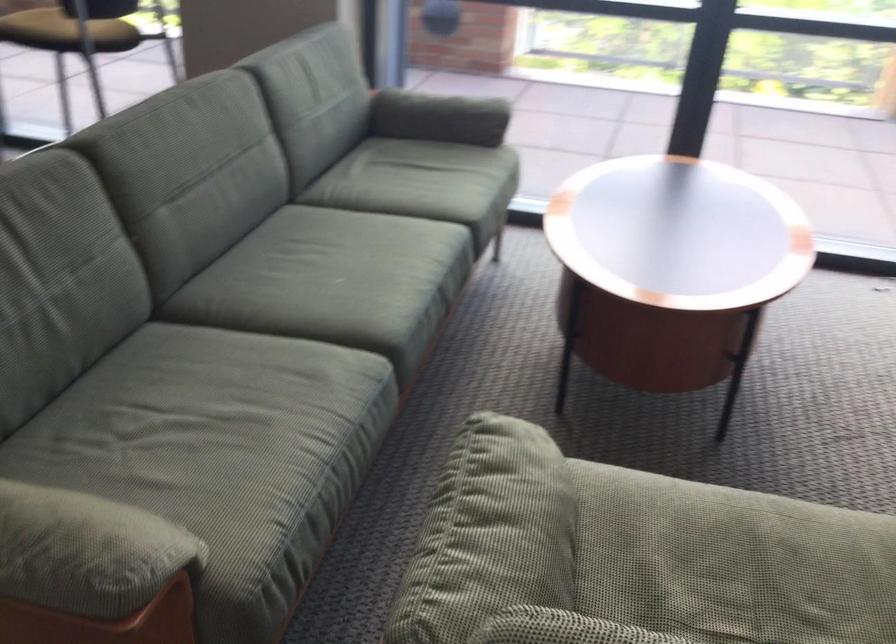
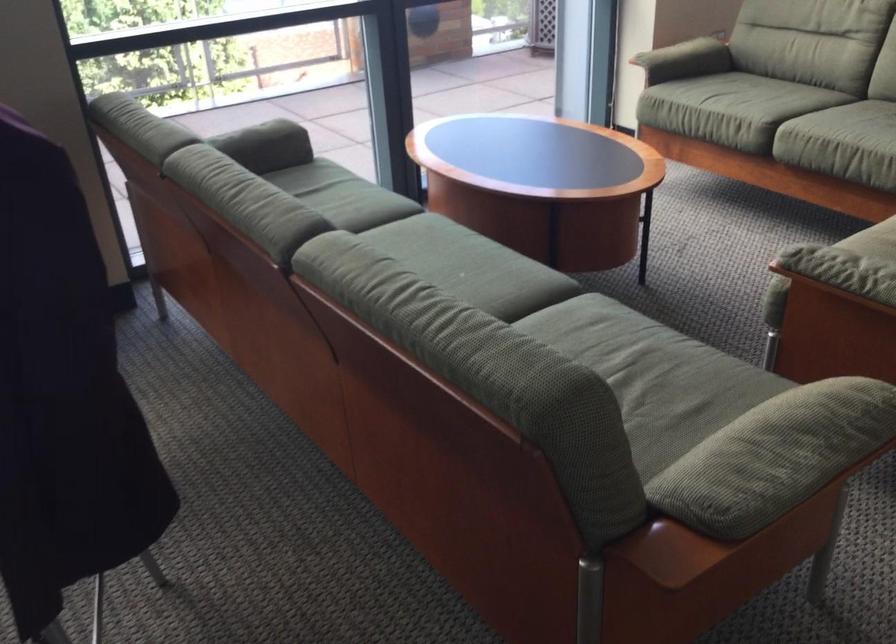
Locate, in the second image, the point that corresponds to [458,108] in the first image.

(265, 140)